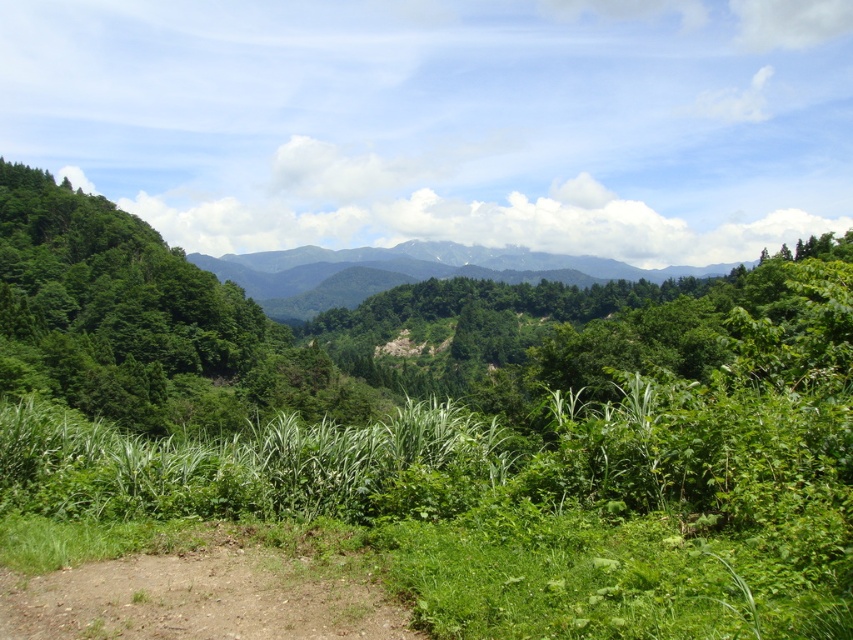
You are a hiker trying to follow the brown dirt track at lower left. There is a green leafy tree at left blocking your path. Can you see the track clearly from your current position?

The brown dirt track at lower left is behind the green leafy tree at left, so the tree is blocking your view of the track. You cannot see the track clearly from your current position.

You are planning to set up a tent in this landscape. The green leafy tree at left and the green forested mountain at center are both in your view. Which of these two objects would allow you to set up a wider tent area around it?

The green forested mountain at center allows for a wider tent area because it has a greater width than the green leafy tree at left.

You are hiking and want to reach the green forested mountain at center from the brown dirt track at lower left. Which direction should you head?

You should head upwards from the brown dirt track at lower left towards the green forested mountain at center since the track is located below the mountain.